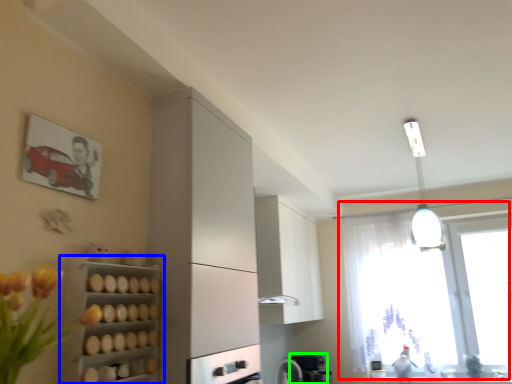
Question: Considering the real-world distances, which object is closest to window (highlighted by a red box)? shelf (highlighted by a blue box) or coffee machine (highlighted by a green box).

Choices:
 (A) shelf
 (B) coffee machine

Answer: (B)